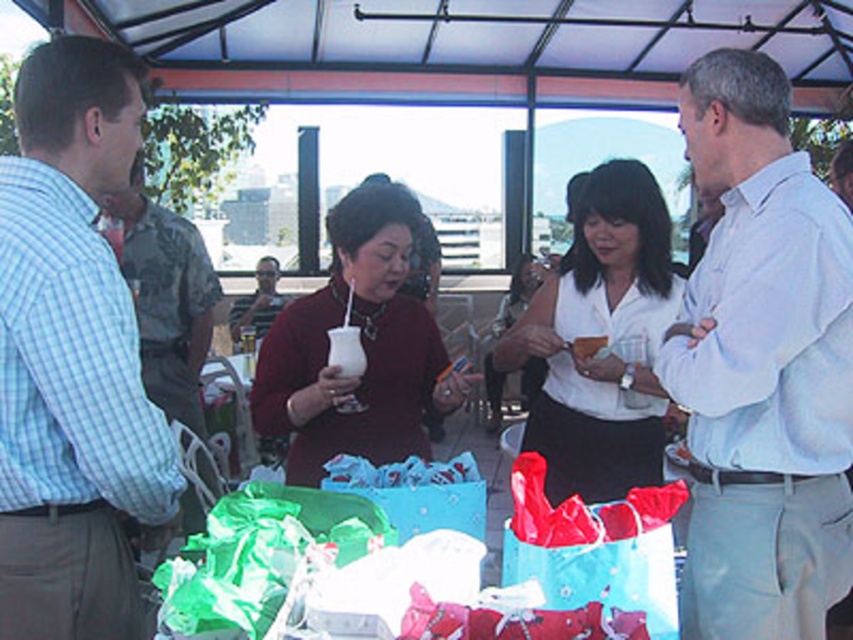
Question: Does light blue checkered shirt at left have a smaller size compared to matte red sweater at center?

Choices:
 (A) yes
 (B) no

Answer: (B)

Question: Is white matte shirt at center to the right of matte red sweater at center from the viewer's perspective?

Choices:
 (A) no
 (B) yes

Answer: (B)

Question: Which point is farther to the camera?

Choices:
 (A) camouflage shirt at left
 (B) light blue shirt at center
 (C) white plastic cup at center
 (D) matte red sweater at center

Answer: (A)

Question: Considering the real-world distances, which object is farthest from the camouflage shirt at left?

Choices:
 (A) light blue shirt at center
 (B) shiny red plastic bag at center
 (C) white matte shirt at center
 (D) matte red sweater at center

Answer: (B)

Question: Does camouflage shirt at left have a greater width compared to matte black shirt at center?

Choices:
 (A) yes
 (B) no

Answer: (B)

Question: Estimate the real-world distances between objects in this image. Which object is farther from the matte black shirt at center?

Choices:
 (A) white plastic cup at center
 (B) white matte shirt at center
 (C) light blue checkered shirt at left

Answer: (A)